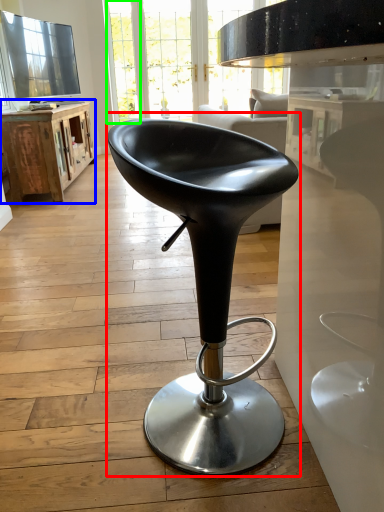
Question: Which object is the farthest from chair (highlighted by a red box)? Choose among these: table (highlighted by a blue box) or glass door (highlighted by a green box).

Choices:
 (A) table
 (B) glass door

Answer: (B)